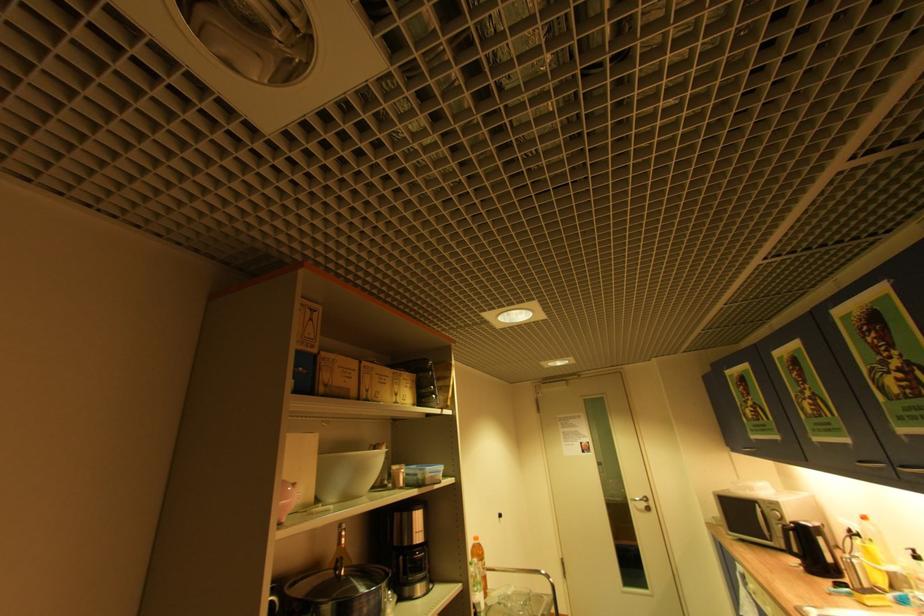
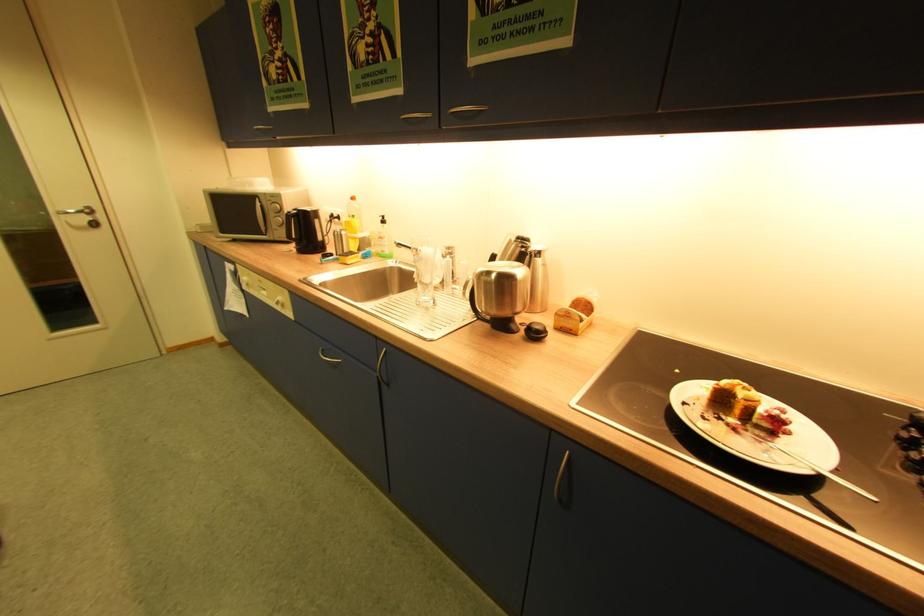
Locate, in the second image, the point that corresponds to pixel 801 552 in the first image.

(299, 237)